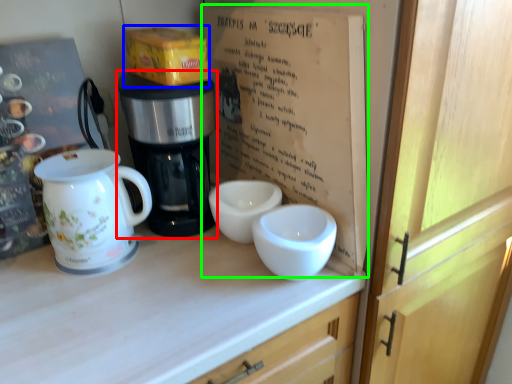
Question: Which object is the closest to the coffee maker (highlighted by a red box)? Choose among these: cardboard box (highlighted by a blue box) or book (highlighted by a green box).

Choices:
 (A) cardboard box
 (B) book

Answer: (A)